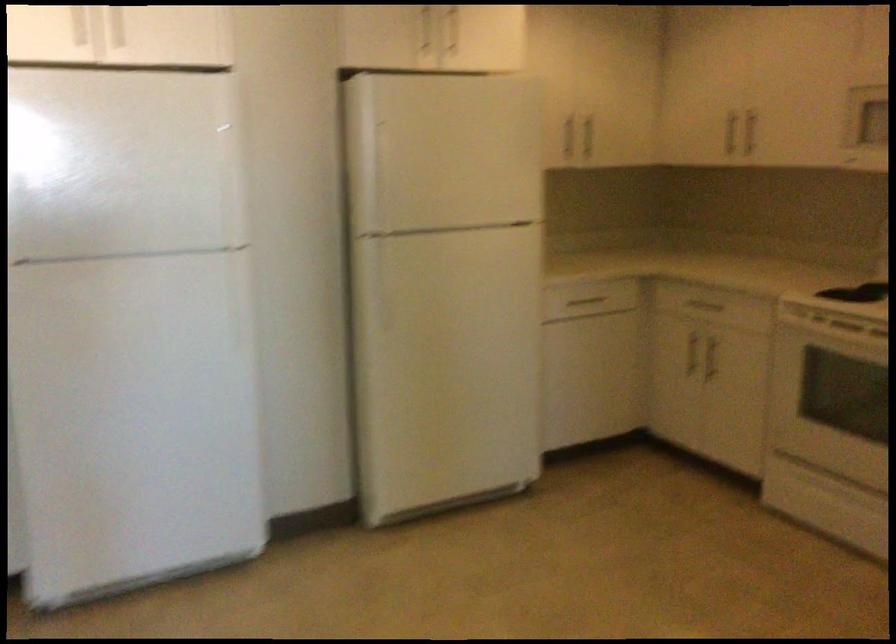
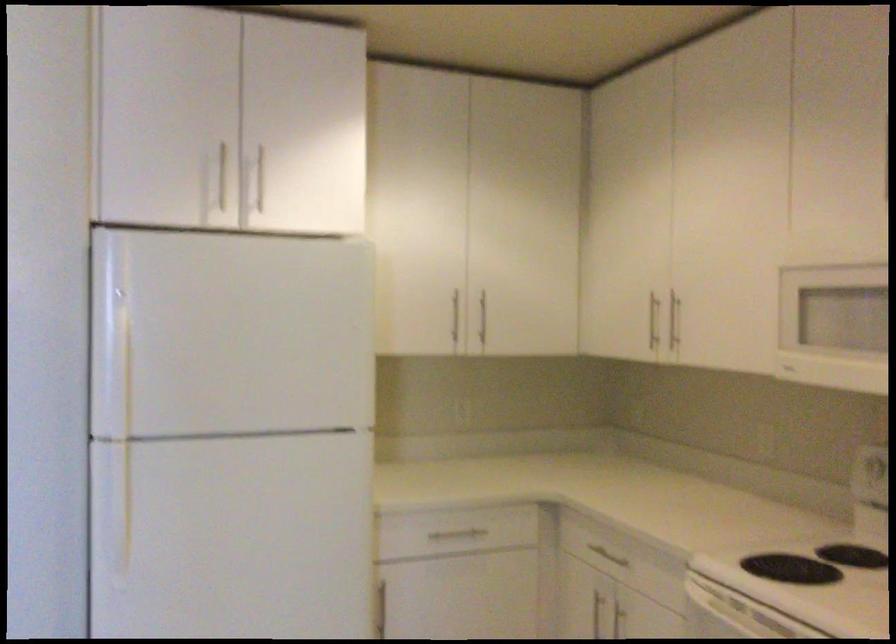
Where in the second image is the point corresponding to (747,129) from the first image?

(673, 321)